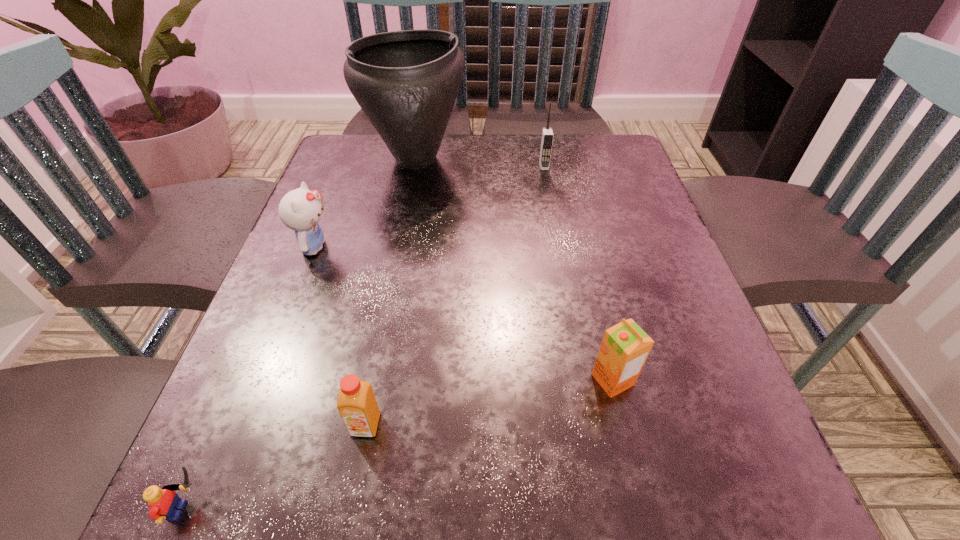
Find the location of a particular element. object that is the second closest one to the nearer orange juice is located at coordinates (625, 347).

Locate which object ranks third in proximity to the nearer orange juice. Please provide its 2D coordinates. Your answer should be formatted as a tuple, i.e. [(x, y)], where the tuple contains the x and y coordinates of a point satisfying the conditions above.

[(300, 210)]

Where is `vacant point that satisfies the following two spatial constraints: 1. on the front-facing side of the cellular telephone; 2. on the front-facing side of the kitten`? The height and width of the screenshot is (540, 960). vacant point that satisfies the following two spatial constraints: 1. on the front-facing side of the cellular telephone; 2. on the front-facing side of the kitten is located at coordinates (559, 247).

The height and width of the screenshot is (540, 960). I want to click on vacant space that satisfies the following two spatial constraints: 1. on the front and back of the left orange juice; 2. on the front-facing side of the nearest object, so click(349, 510).

This screenshot has height=540, width=960. I want to click on vacant space that satisfies the following two spatial constraints: 1. on the front side of the tallest object; 2. on the front-facing side of the nearest object, so click(348, 510).

Where is `free spot that satisfies the following two spatial constraints: 1. on the front side of the tallest object; 2. on the left side of the rightmost object`? free spot that satisfies the following two spatial constraints: 1. on the front side of the tallest object; 2. on the left side of the rightmost object is located at coordinates (373, 380).